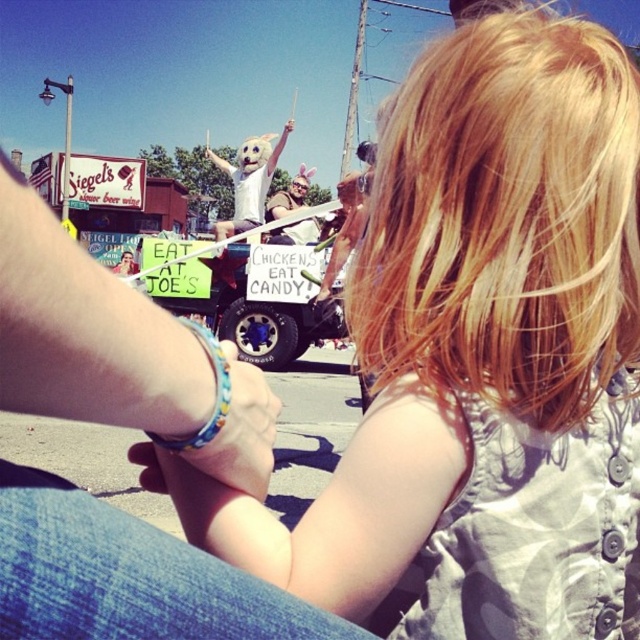
You are a photographer trying to capture the scene. The blonde hair at upper center and the multicolored beaded bracelet on the wrist are both in your viewfinder. Which object should you focus on if you want to capture the wider object?

The blonde hair at upper center is wider than the multicolored beaded bracelet on the wrist, so you should focus on the blonde hair at upper center to capture the wider object.